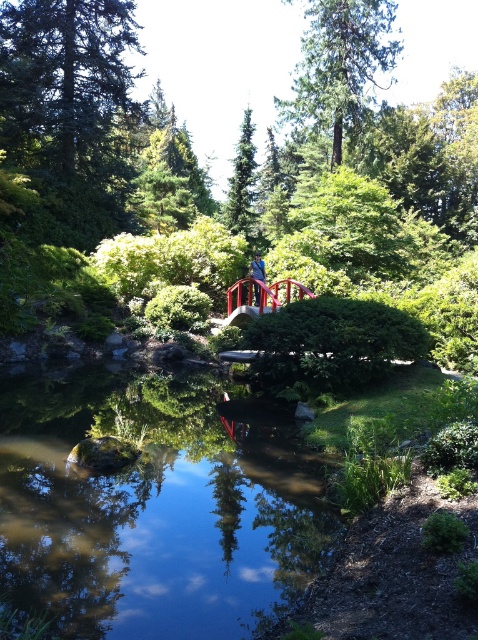
Consider the image. You are a visitor in the Japanese garden and want to cross the smooth red bridge at center to the other side. However, you notice the clear water at center below the bridge. Is the bridge high enough to allow you to walk across without bending down?

The clear water at center is not as tall as the smooth red bridge at center, meaning the bridge is taller. Therefore, the bridge is high enough for you to walk across comfortably without needing to bend down.

You are standing at the entrance of the garden and want to take a photo of both the clear water at center and the green textured tree at upper center. Given that your camera has a maximum focus range of 20 meters, will you be able to capture both subjects in focus without moving your position?

The clear water at center is 24.42 meters away from the green textured tree at upper center. Since your camera can only focus up to 20 meters, it won that distance, so you won the clear water at center and the green textured tree at upper center in focus without moving.

You are standing at the center of the Japanese garden and want to walk to both the point at coordinates point (347, 19) and point (250, 177). Which point should you reach first based on their positions?

You should reach point (347, 19) first because it is closer to you than point (250, 177).